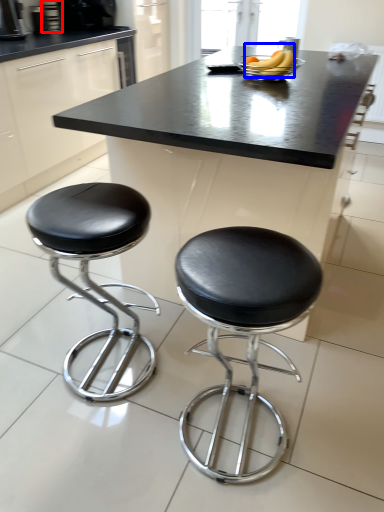
Question: Which object appears closest to the camera in this image, appliance (highlighted by a red box) or banana (highlighted by a blue box)?

Choices:
 (A) appliance
 (B) banana

Answer: (B)